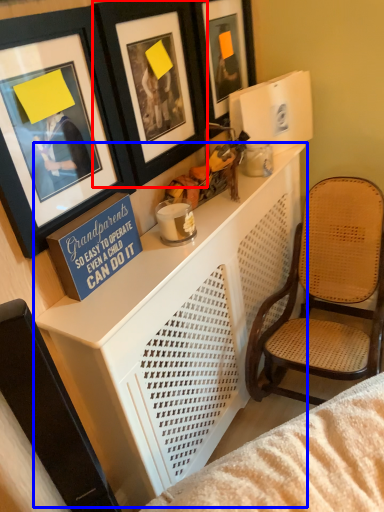
Question: Among these objects, which one is farthest to the camera, picture frame (highlighted by a red box) or table (highlighted by a blue box)?

Choices:
 (A) picture frame
 (B) table

Answer: (A)